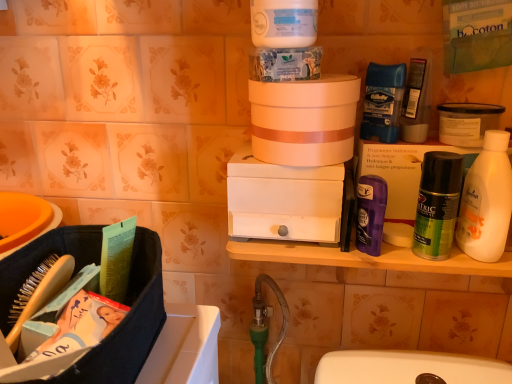
You are a GUI agent. You are given a task and a screenshot of the screen. Output one action in this format:
    pyautogui.click(x=<x>, y=<y>)
    Task: Click on the green matte mouthwash at right
    This screenshot has width=512, height=384.
    Given the screenshot: What is the action you would take?
    pyautogui.click(x=437, y=204)

The image size is (512, 384). Describe the element at coordinates (467, 122) in the screenshot. I see `white matte jar at upper right, which is the second product from left to right` at that location.

How much space does white matte jar at upper right, which is the 1th product in bottom-to-top order, occupy vertically?

The height of white matte jar at upper right, which is the 1th product in bottom-to-top order, is 2.50 inches.

The height and width of the screenshot is (384, 512). What do you see at coordinates (370, 213) in the screenshot?
I see `purple matte deodorant at right, the second toiletry viewed from the top` at bounding box center [370, 213].

Describe the element at coordinates (401, 181) in the screenshot. I see `matte white box at right, which is the 2th box from left to right` at that location.

Measure the distance between matte white box at right, which is the 2th box from left to right, and camera.

matte white box at right, which is the 2th box from left to right, is 24.88 inches away from camera.

What is the approximate width of white plastic bottle at right?

It is 5.70 centimeters.

This screenshot has width=512, height=384. Describe the element at coordinates (283, 200) in the screenshot. I see `white matte drawer at center, the second box positioned from the right` at that location.

Locate an element on the screen. white matte jar at upper center is located at coordinates (283, 23).

Identify the location of green matte mouthwash at right. click(437, 204).

Is white plastic bottle at right bigger or smaller than white matte jar at upper center?

In the image, white plastic bottle at right appears to be larger than white matte jar at upper center.

Between white plastic bottle at right and white matte jar at upper center, which one has more height?

white plastic bottle at right.

Is white plastic bottle at right thinner than white matte jar at upper center?

Correct, the width of white plastic bottle at right is less than that of white matte jar at upper center.

This screenshot has width=512, height=384. I want to click on bottle behind the white matte jar at upper center, so click(x=486, y=201).

Could you measure the distance between white matte jar at upper center and white matte jar at upper right, the 1th product positioned from the right?

A distance of 10.96 inches exists between white matte jar at upper center and white matte jar at upper right, the 1th product positioned from the right.

Between white matte jar at upper center and white matte jar at upper right, the second product when ordered from top to bottom, which one has larger width?

Wider between the two is white matte jar at upper right, the second product when ordered from top to bottom.

You are a GUI agent. You are given a task and a screenshot of the screen. Output one action in this format:
    pyautogui.click(x=<x>, y=<y>)
    Task: Click on the 2nd product located beneath the white matte jar at upper center (from a real-world perspective)
    
    Given the screenshot: What is the action you would take?
    pyautogui.click(x=467, y=122)

Can you tell me how much white matte jar at upper center and white matte jar at upper right, the second product when ordered from top to bottom, differ in facing direction?

0.000439 degrees separate the facing orientations of white matte jar at upper center and white matte jar at upper right, the second product when ordered from top to bottom.

From a real-world perspective, does green matte mouthwash at right sit lower than white matte jar at upper right, the second product when ordered from top to bottom?

Yes, from a real-world perspective, green matte mouthwash at right is below white matte jar at upper right, the second product when ordered from top to bottom.

How much distance is there between green matte mouthwash at right and white matte jar at upper right, which is the second product from left to right?

They are 3.40 inches apart.

From the image's perspective, is green matte mouthwash at right over white matte jar at upper right, which is the second product from left to right?

No, from the image's perspective, green matte mouthwash at right is not on top of white matte jar at upper right, which is the second product from left to right.

Is the depth of green matte mouthwash at right less than that of white matte jar at upper right, which is the second product from left to right?

Yes, green matte mouthwash at right is closer to the camera.

Is white matte jar at upper right, which is the 1th product in bottom-to-top order, inside the boundaries of white matte jar at upper center, or outside?

white matte jar at upper right, which is the 1th product in bottom-to-top order, exists outside the volume of white matte jar at upper center.

From a real-world perspective, is white matte jar at upper right, which is the 1th product in bottom-to-top order, below white matte jar at upper center?

Yes, from a real-world perspective, white matte jar at upper right, which is the 1th product in bottom-to-top order, is below white matte jar at upper center.

Is white matte jar at upper right, which is the second product from left to right, turned away from white matte jar at upper center?

That's not correct — white matte jar at upper right, which is the second product from left to right, is not looking away from white matte jar at upper center.

Is white matte jar at upper right, which is the second product from left to right, wider than white matte jar at upper center?

Correct, the width of white matte jar at upper right, which is the second product from left to right, exceeds that of white matte jar at upper center.

From the picture: Can you confirm if purple matte deodorant at right, marked as the second toiletry in a back-to-front arrangement, is thinner than matte white box at right, the 1th box viewed from the right?

Yes, purple matte deodorant at right, marked as the second toiletry in a back-to-front arrangement, is thinner than matte white box at right, the 1th box viewed from the right.

This screenshot has height=384, width=512. Find the location of `the 2nd box above the purple matte deodorant at right, the second toiletry viewed from the top (from the image's perspective)`. the 2nd box above the purple matte deodorant at right, the second toiletry viewed from the top (from the image's perspective) is located at coordinates (401, 181).

Which is correct: purple matte deodorant at right, positioned as the 1th toiletry in front-to-back order, is inside matte white box at right, which is the 2th box from left to right, or outside of it?

purple matte deodorant at right, positioned as the 1th toiletry in front-to-back order, is not enclosed by matte white box at right, which is the 2th box from left to right.

Considering the relative positions of purple matte deodorant at right, positioned as the 1th toiletry in front-to-back order, and matte white box at right, which is the 2th box from left to right, in the image provided, is purple matte deodorant at right, positioned as the 1th toiletry in front-to-back order, to the left or to the right of matte white box at right, which is the 2th box from left to right,?

purple matte deodorant at right, positioned as the 1th toiletry in front-to-back order, is positioned on matte white box at right, which is the 2th box from left to right,'s left side.

From the image's perspective, is matte white box at right, which is the 2th box from left to right, under blue matte deodorant at upper right, the second toiletry from the bottom?

Yes, from the image's perspective, matte white box at right, which is the 2th box from left to right, is beneath blue matte deodorant at upper right, the second toiletry from the bottom.

Is matte white box at right, the 1th box viewed from the right, taller or shorter than blue matte deodorant at upper right, the 1th toiletry positioned from the back?

matte white box at right, the 1th box viewed from the right, is taller than blue matte deodorant at upper right, the 1th toiletry positioned from the back.

Does matte white box at right, which is the 2th box from left to right, have a smaller size compared to blue matte deodorant at upper right, which is counted as the first toiletry, starting from the top?

No.

From a real-world perspective, between matte white box at right, which is the 2th box from left to right, and blue matte deodorant at upper right, the second toiletry from the bottom, who is vertically lower?

matte white box at right, which is the 2th box from left to right, from a real-world perspective.

How many degrees apart are the facing directions of blue paper towel at upper center, acting as the first product starting from the left, and green matte mouthwash at right?

They differ by 0.00721 degrees in their facing directions.

In the scene shown: From a real-world perspective, is blue paper towel at upper center, the second product viewed from the right, below green matte mouthwash at right?

No, from a real-world perspective, blue paper towel at upper center, the second product viewed from the right, is not below green matte mouthwash at right.

From the image's perspective, which one is positioned higher, blue paper towel at upper center, the first product from the top, or green matte mouthwash at right?

blue paper towel at upper center, the first product from the top, from the image's perspective.

Is blue paper towel at upper center, arranged as the 2th product when ordered from the bottom, wider than green matte mouthwash at right?

Yes, blue paper towel at upper center, arranged as the 2th product when ordered from the bottom, is wider than green matte mouthwash at right.

At what (x,y) coordinates should I click in order to perform the action: click on cleaning product that appears in front of the white plastic bottle at right. Please return your answer as a coordinate pair (x, y). This screenshot has height=384, width=512. Looking at the image, I should click on (283, 23).

In order to click on product on the right of white matte jar at upper center in this screenshot , I will do `click(467, 122)`.

Consider the image. Considering their positions, is green matte mouthwash at right positioned further to purple matte deodorant at right, positioned as the 1th toiletry in front-to-back order, than white plastic bottle at right?

white plastic bottle at right is positioned further to the anchor purple matte deodorant at right, positioned as the 1th toiletry in front-to-back order.

From the image, which object appears to be farther from green matte mouthwash at right, white matte jar at upper right, the second product when ordered from top to bottom, or purple matte deodorant at right, the second toiletry viewed from the top?

white matte jar at upper right, the second product when ordered from top to bottom, is positioned further to the anchor green matte mouthwash at right.

Looking at the image, which one is located further to matte white box at right, the 1th box viewed from the right, blue matte deodorant at upper right, the second toiletry from the bottom, or white matte jar at upper right, which is the 1th product in bottom-to-top order?

Among the two, white matte jar at upper right, which is the 1th product in bottom-to-top order, is located further to matte white box at right, the 1th box viewed from the right.

Looking at the image, which one is located closer to white plastic bottle at right, white matte jar at upper center or green matte mouthwash at right?

Result: green matte mouthwash at right lies closer to white plastic bottle at right than the other object.

Which object lies nearer to the anchor point purple matte deodorant at right, marked as the second toiletry in a back-to-front arrangement, white matte jar at upper center or green matte mouthwash at right?

The object closer to purple matte deodorant at right, marked as the second toiletry in a back-to-front arrangement, is green matte mouthwash at right.

Estimate the real-world distances between objects in this image. Which object is closer to green matte mouthwash at right, purple matte deodorant at right, positioned as the 1th toiletry in front-to-back order, or blue paper towel at upper center, arranged as the 2th product when ordered from the bottom?

purple matte deodorant at right, positioned as the 1th toiletry in front-to-back order, is closer to green matte mouthwash at right.

Estimate the real-world distances between objects in this image. Which object is further from white matte jar at upper center, blue paper towel at upper center, acting as the first product starting from the left, or white matte jar at upper right, which is the second product from left to right?

white matte jar at upper right, which is the second product from left to right.

Considering their positions, is white matte jar at upper right, which is the 1th product in bottom-to-top order, positioned further to white plastic bottle at right than white matte drawer at center, the second box positioned from the right?

white matte drawer at center, the second box positioned from the right, is further to white plastic bottle at right.

Find the location of a particular element. mouthwash between white matte drawer at center, which is the 1th box from left to right, and white matte jar at upper right, which is the 1th product in bottom-to-top order, from left to right is located at coordinates (437, 204).

At what (x,y) coordinates should I click in order to perform the action: click on box between white matte drawer at center, the second box positioned from the right, and green matte mouthwash at right from left to right. Please return your answer as a coordinate pair (x, y). The height and width of the screenshot is (384, 512). Looking at the image, I should click on (401, 181).

At what (x,y) coordinates should I click in order to perform the action: click on cleaning product situated between blue paper towel at upper center, the first product from the top, and white matte jar at upper right, which is the 1th product in bottom-to-top order, from left to right. Please return your answer as a coordinate pair (x, y). Looking at the image, I should click on (283, 23).

Where is `mouthwash located between white plastic bottle at right and matte white box at right, which is the 2th box from left to right, in the depth direction`? mouthwash located between white plastic bottle at right and matte white box at right, which is the 2th box from left to right, in the depth direction is located at coordinates (437, 204).